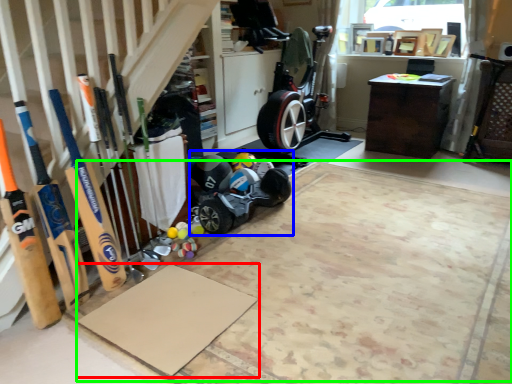
Question: Which object is positioned farthest from yoga mat (highlighted by a red box)? Select from baby carriage (highlighted by a blue box) and yoga mat (highlighted by a green box).

Choices:
 (A) baby carriage
 (B) yoga mat

Answer: (A)